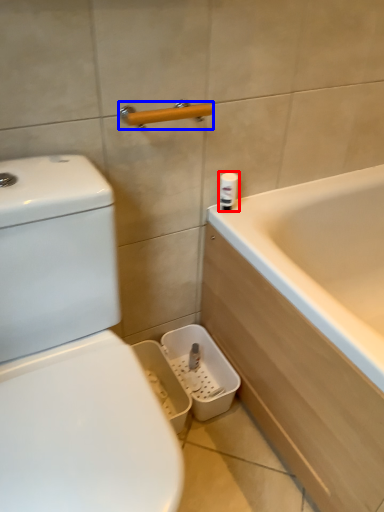
Question: Which point is closer to the camera, toiletry (highlighted by a red box) or towel bar (highlighted by a blue box)?

Choices:
 (A) toiletry
 (B) towel bar

Answer: (B)